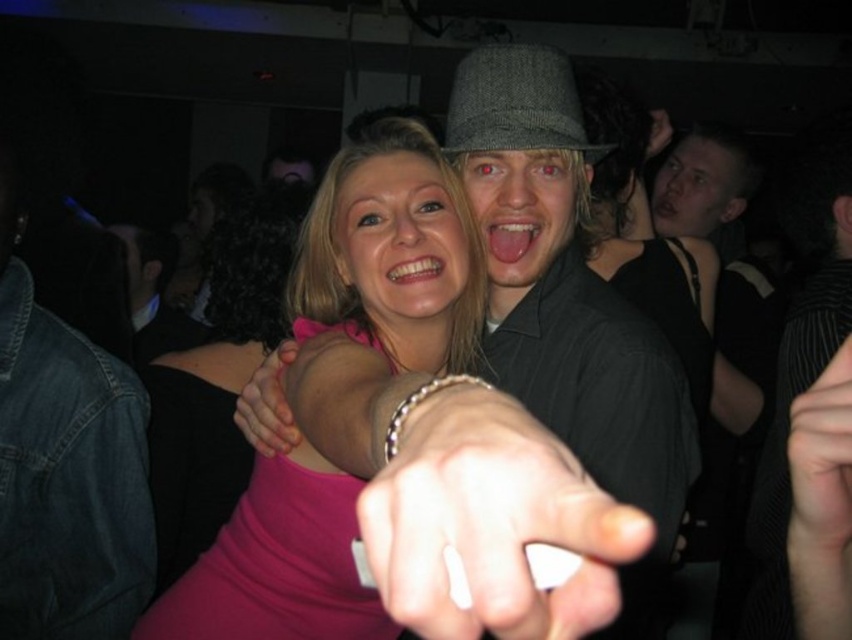
Question: Considering the real-world distances, which object is farthest from the matte black face at upper right?

Choices:
 (A) gray woolen fedora at center
 (B) matte gray hat at center
 (C) smooth black hand at center

Answer: (C)

Question: Among these points, which one is farthest from the camera?

Choices:
 (A) 140,372
 (B) 369,308
 (C) 429,573

Answer: (A)

Question: Does gray textured hat at center have a lesser width compared to matte gray hat at center?

Choices:
 (A) no
 (B) yes

Answer: (A)

Question: Does dark gray textured shirt at center have a smaller size compared to pink glossy tongue at center?

Choices:
 (A) no
 (B) yes

Answer: (A)

Question: Does smooth black hand at center have a smaller size compared to white glossy teeth at center?

Choices:
 (A) no
 (B) yes

Answer: (A)

Question: Among these objects, which one is nearest to the camera?

Choices:
 (A) gray woolen fedora at center
 (B) pink glossy tongue at center

Answer: (A)